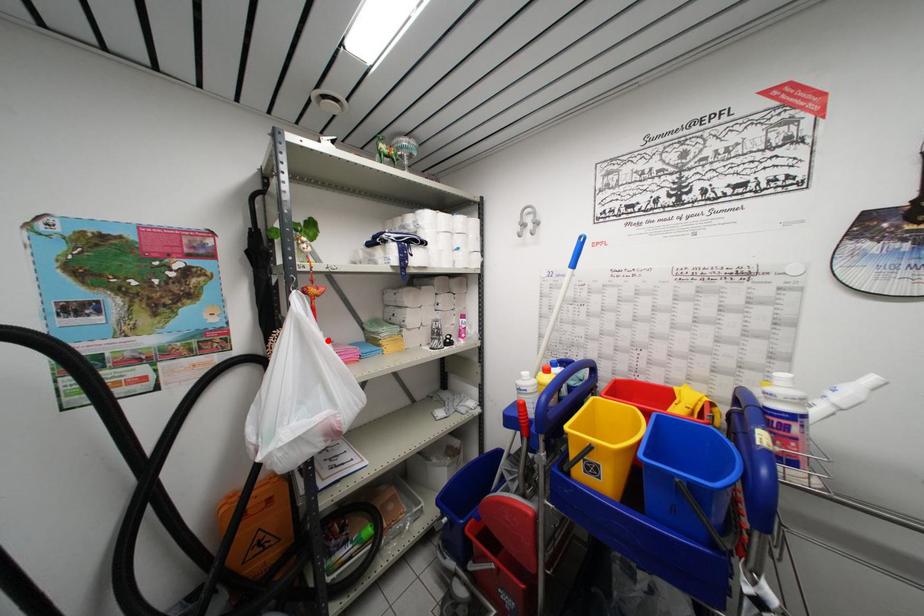
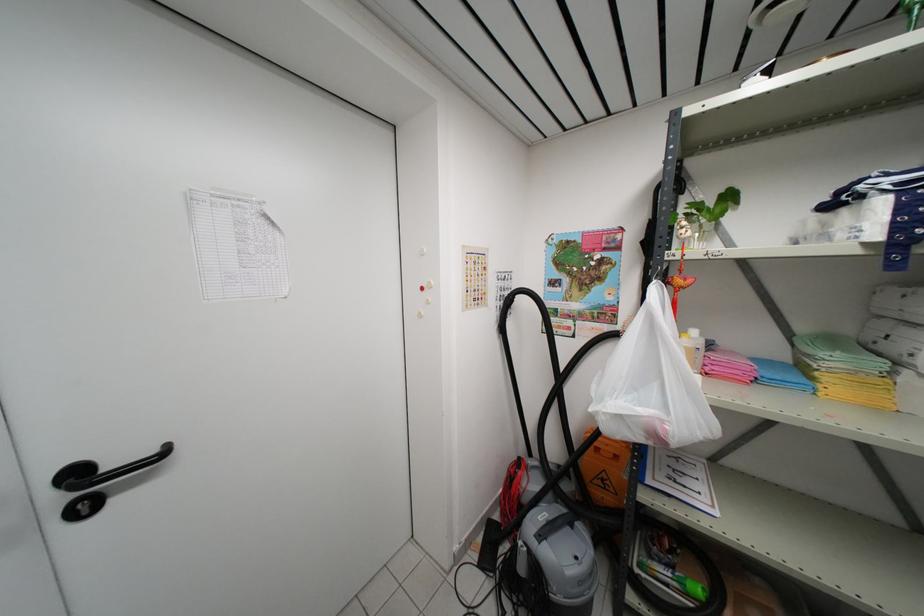
Where in the second image is the point corresponding to the highlighted location from the first image?

(704, 339)